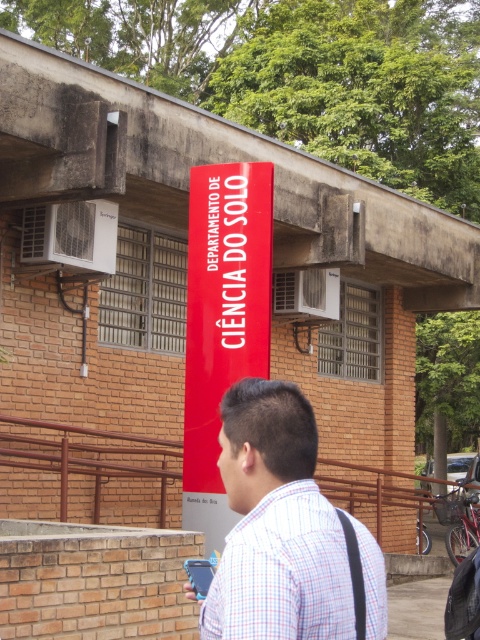
Is point (337, 602) behind point (210, 372)?

No, it is not.

Does point (228, 424) come closer to viewer compared to point (264, 173)?

Yes, point (228, 424) is closer to viewer.

You are a GUI agent. You are given a task and a screenshot of the screen. Output one action in this format:
    pyautogui.click(x=<x>, y=<y>)
    Task: Click on the plaid shirt at center
    Image resolution: width=480 pixels, height=640 pixels.
    Given the screenshot: What is the action you would take?
    pyautogui.click(x=276, y=525)